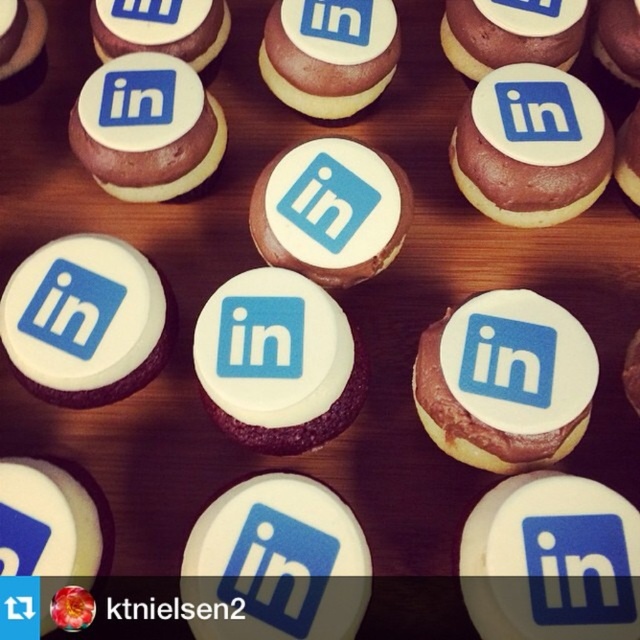
Does white glossy cupcake at center-left appear on the right side of matte chocolate cupcake at upper center?

In fact, white glossy cupcake at center-left is to the left of matte chocolate cupcake at upper center.

Consider the image. Which is above, white glossy cupcake at center-left or matte chocolate cupcake at upper center?

matte chocolate cupcake at upper center

Who is more forward, (x=145, y=259) or (x=499, y=0)?

Point (x=145, y=259)

Where is `white glossy cupcake at center-left`? This screenshot has width=640, height=640. white glossy cupcake at center-left is located at coordinates (84, 321).

Describe the element at coordinates (531, 147) in the screenshot. I see `matte chocolate cupcake at upper right` at that location.

I want to click on matte chocolate cupcake at upper right, so click(531, 147).

Locate an element on the screen. This screenshot has height=640, width=640. matte chocolate cupcake at upper right is located at coordinates (531, 147).

Between matte chocolate cupcake at upper right and white glossy cupcake at center, which one appears on the left side from the viewer's perspective?

white glossy cupcake at center

Does matte chocolate cupcake at upper right appear under white glossy cupcake at center?

Actually, matte chocolate cupcake at upper right is above white glossy cupcake at center.

Between point (496, 132) and point (321, 195), which one is positioned behind?

Positioned behind is point (496, 132).

Identify the location of matte chocolate cupcake at upper right. (531, 147).